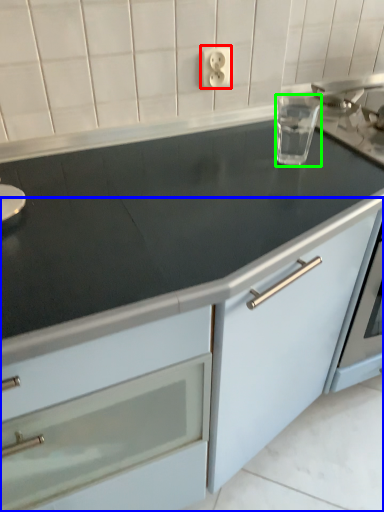
Question: Which object is the farthest from electric outlet (highlighted by a red box)? Choose among these: cabinetry (highlighted by a blue box) or appliance (highlighted by a green box).

Choices:
 (A) cabinetry
 (B) appliance

Answer: (A)